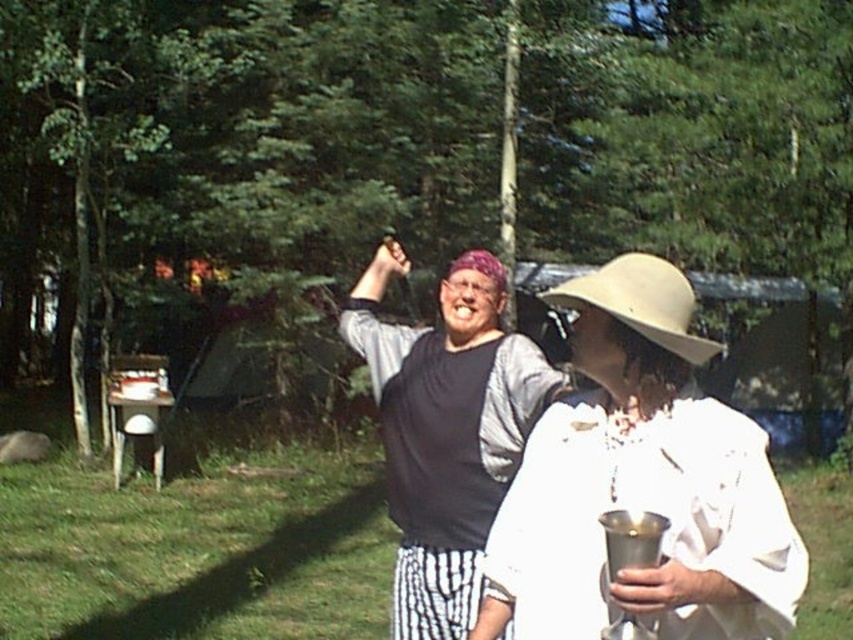
From the picture: Who is shorter, white matte hat at center or matte black shirt at center?

Standing shorter between the two is white matte hat at center.

Is white matte hat at center thinner than matte black shirt at center?

Correct, white matte hat at center's width is less than matte black shirt at center's.

Between point (610, 324) and point (468, 524), which one is positioned behind?

The point (468, 524) is more distant.

The width and height of the screenshot is (853, 640). I want to click on white matte hat at center, so click(x=642, y=483).

Who is shorter, white matte hat at center or beige fabric hat at upper center?

white matte hat at center is shorter.

Looking at this image, between white matte hat at center and beige fabric hat at upper center, which one is positioned higher?

Positioned higher is beige fabric hat at upper center.

You are a GUI agent. You are given a task and a screenshot of the screen. Output one action in this format:
    pyautogui.click(x=<x>, y=<y>)
    Task: Click on the white matte hat at center
    Image resolution: width=853 pixels, height=640 pixels.
    Given the screenshot: What is the action you would take?
    pyautogui.click(x=642, y=483)

Does point (431, 556) come behind point (688, 305)?

Yes, point (431, 556) is behind point (688, 305).

Is matte black shirt at center to the left of beige fabric hat at upper center from the viewer's perspective?

Yes, matte black shirt at center is to the left of beige fabric hat at upper center.

Does point (431, 481) come behind point (677, 269)?

No, it is in front of (677, 269).

This screenshot has height=640, width=853. Identify the location of matte black shirt at center. (445, 429).